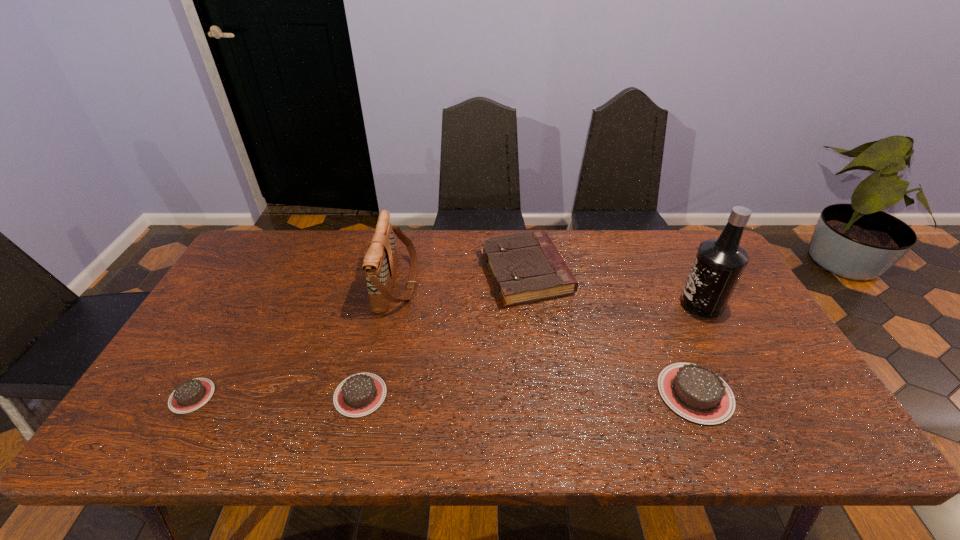
Locate an element on the screen. The height and width of the screenshot is (540, 960). object that is at the left edge is located at coordinates (192, 394).

Locate an element on the screen. This screenshot has height=540, width=960. object that is at the right edge is located at coordinates (719, 263).

Where is `object at the near left corner`? This screenshot has height=540, width=960. object at the near left corner is located at coordinates (192, 394).

At what (x,y) coordinates should I click in order to perform the action: click on vacant space at the far edge of the desktop. Please return your answer as a coordinate pair (x, y). Looking at the image, I should click on (340, 233).

Locate an element on the screen. This screenshot has width=960, height=540. free space at the near edge of the desktop is located at coordinates (474, 387).

Identify the location of vacant space at the far right corner. The image size is (960, 540). (670, 248).

Locate an element on the screen. Image resolution: width=960 pixels, height=540 pixels. free spot between the fourth tallest object and the tallest object is located at coordinates (698, 348).

The width and height of the screenshot is (960, 540). Find the location of `unoccupied position between the rightmost chocolate cake and the fourth shortest object`. unoccupied position between the rightmost chocolate cake and the fourth shortest object is located at coordinates (611, 333).

Where is `vacant space in between the liquor and the shortest object`? The image size is (960, 540). vacant space in between the liquor and the shortest object is located at coordinates (446, 350).

The height and width of the screenshot is (540, 960). Identify the location of vacant region between the shortest chocolate cake and the second shortest object. (276, 395).